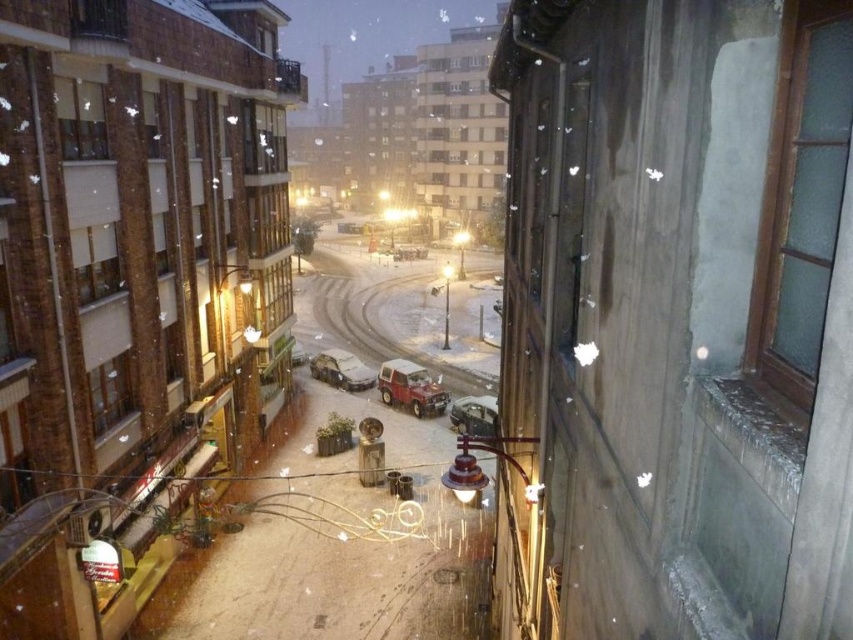
You are standing inside a building looking through the window. You see the sandy concrete alley at center and the metallic silver car at center. Which object is closer to you?

The sandy concrete alley at center is closer to the viewer than the metallic silver car at center.

You are a delivery robot that is 1.5 meters wide. You need to navigate through the snowy street to deliver a package. Can you fit between the sandy concrete alley at center and the sleek metallic car at center?

The sandy concrete alley at center and the sleek metallic car at center are 4.07 meters apart from each other. Since the delivery robot is 1.5 meters wide, it can easily fit through the 4.07 meters gap between them.

You are a delivery person who needs to load a tall package into your van. You see the sleek metallic car at center and the metallic silver car at center parked on the snowy street. Which car would you choose to park next to if you need more vertical space for loading?

The sleek metallic car at center is much taller than the metallic silver car at center, so you should park next to the metallic silver car at center to have more vertical space for loading your tall package.